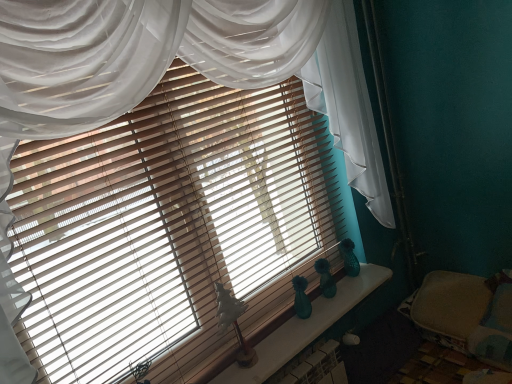
Question: Would you say beige fabric bed at lower right is part of teal glass vases at center's contents?

Choices:
 (A) yes
 (B) no

Answer: (B)

Question: Can you confirm if teal glass vases at center is taller than beige fabric bed at lower right?

Choices:
 (A) yes
 (B) no

Answer: (B)

Question: Are teal glass vases at center and beige fabric bed at lower right beside each other?

Choices:
 (A) yes
 (B) no

Answer: (B)

Question: Does teal glass vases at center have a lesser width compared to beige fabric bed at lower right?

Choices:
 (A) yes
 (B) no

Answer: (A)

Question: Considering the relative sizes of teal glass vases at center and beige fabric bed at lower right in the image provided, is teal glass vases at center wider than beige fabric bed at lower right?

Choices:
 (A) no
 (B) yes

Answer: (A)

Question: Is teal glass vases at center facing away from beige fabric bed at lower right?

Choices:
 (A) no
 (B) yes

Answer: (A)

Question: Is beige fabric bed at lower right smaller than teal glass vases at center?

Choices:
 (A) no
 (B) yes

Answer: (A)

Question: Is beige fabric bed at lower right beside teal glass vases at center?

Choices:
 (A) no
 (B) yes

Answer: (A)

Question: Considering the relative sizes of beige fabric bed at lower right and teal glass vases at center in the image provided, is beige fabric bed at lower right wider than teal glass vases at center?

Choices:
 (A) no
 (B) yes

Answer: (B)

Question: Could you tell me if beige fabric bed at lower right is facing teal glass vases at center?

Choices:
 (A) no
 (B) yes

Answer: (B)

Question: Is the depth of beige fabric bed at lower right greater than that of teal glass vases at center?

Choices:
 (A) yes
 (B) no

Answer: (A)

Question: Does beige fabric bed at lower right have a lesser width compared to teal glass vases at center?

Choices:
 (A) no
 (B) yes

Answer: (A)

Question: In terms of width, does teal glass vases at center look wider or thinner when compared to beige fabric bed at lower right?

Choices:
 (A) thin
 (B) wide

Answer: (A)